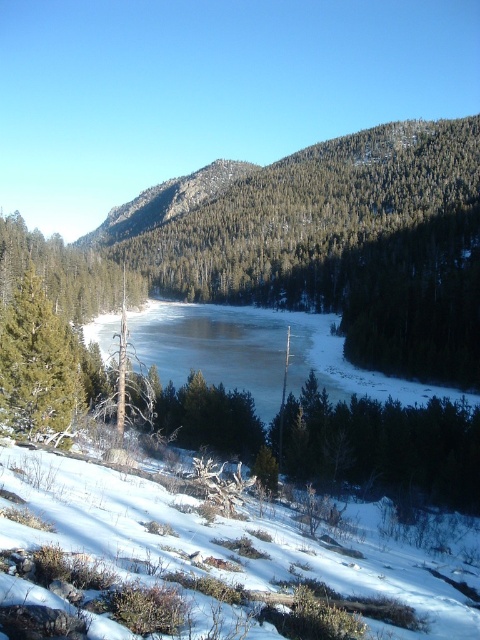
You are standing at the edge of the frozen lake and notice the white fluffy snow at lower left and the green matte tree at left. Which object is nearer to you?

The white fluffy snow at lower left is closer to the viewer than the green matte tree at left.

You are an explorer trying to cross the frozen lake. You notice the white fluffy snow at lower left and the green matte tree at left. Which of these two objects has a smaller horizontal spread in the image?

The white fluffy snow at lower left has a lesser width compared to the green matte tree at left, so it has a smaller horizontal spread.

You are standing at the point marked as point (347, 244) in the image, which is labeled as brown wood tree at center. What is the nearest object to you in the scene?

The nearest object to you is the brown wood tree at center, as you are standing at its marked location.